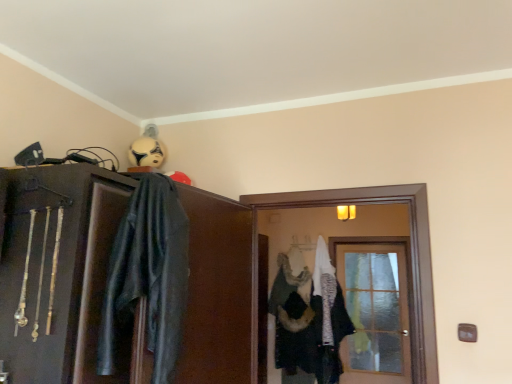
The image size is (512, 384). Describe the element at coordinates (59, 271) in the screenshot. I see `matte black cabinet at upper left` at that location.

Measure the distance between translucent glass door at center and camera.

The distance of translucent glass door at center from camera is 6.02 feet.

Measure the distance between point (293, 383) and camera.

The distance of point (293, 383) from camera is 4.34 meters.

Based on the photo, what is the approximate height of dark gray leather jacket at upper left?

It is 81.03 centimeters.

Locate an element on the screen. This screenshot has width=512, height=384. fur-like fabric hanger at center is located at coordinates (295, 259).

This screenshot has width=512, height=384. I want to click on white matte helmet at upper center, so [x=146, y=151].

The image size is (512, 384). I want to click on screen door in front of the white matte helmet at upper center, so click(x=411, y=259).

Is translucent glass door at center positioned in front of white matte helmet at upper center?

Yes, it is.

From the image's perspective, relative to white matte helmet at upper center, is translucent glass door at center above or below?

Based on their image positions, translucent glass door at center is located beneath white matte helmet at upper center.

Is the surface of translucent glass door at center in direct contact with white matte helmet at upper center?

They are not placed beside each other.

The image size is (512, 384). I want to click on hanger below the translucent glass door at center (from the image's perspective), so click(x=295, y=259).

Between translucent glass door at center and fur-like fabric hanger at center, which one has smaller width?

translucent glass door at center.

Which of these two, translucent glass door at center or fur-like fabric hanger at center, stands shorter?

fur-like fabric hanger at center is shorter.

Is translucent glass door at center with fur-like fabric hanger at center?

No.

In the image, there is a dark gray leather jacket at upper left. At what (x,y) coordinates should I click in order to perform the action: click on door below it (from the image's perspective). Please return your answer as a coordinate pair (x, y). The width and height of the screenshot is (512, 384). Looking at the image, I should click on (375, 311).

Is point (377, 298) behind point (147, 302)?

Yes.

Can you confirm if clear glass door at center is positioned to the left of dark gray leather jacket at upper left?

Incorrect, clear glass door at center is not on the left side of dark gray leather jacket at upper left.

From a real-world perspective, which object stands above the other?

From a 3D spatial view, matte black cabinet at upper left is above.

Is matte black cabinet at upper left in contact with white fuzzy coat at center?

matte black cabinet at upper left and white fuzzy coat at center are not in contact.

Considering the sizes of matte black cabinet at upper left and white fuzzy coat at center in the image, is matte black cabinet at upper left bigger or smaller than white fuzzy coat at center?

In the image, matte black cabinet at upper left appears to be larger than white fuzzy coat at center.

Could you tell me if matte black cabinet at upper left is facing white fuzzy coat at center?

No, matte black cabinet at upper left is not turned towards white fuzzy coat at center.

Considering the positions of points (350, 203) and (353, 272), is point (350, 203) closer to camera compared to point (353, 272)?

Yes, it is.

Is translucent glass door at center wider than clear glass door at center?

Indeed, translucent glass door at center has a greater width compared to clear glass door at center.

Where is `door lying behind the translucent glass door at center`? door lying behind the translucent glass door at center is located at coordinates (375, 311).

Which object is closer to the camera, translucent glass door at center or clear glass door at center?

translucent glass door at center.

Does white matte helmet at upper center have a larger size compared to dark gray leather jacket at upper left?

Actually, white matte helmet at upper center might be smaller than dark gray leather jacket at upper left.

In the scene shown: Does white matte helmet at upper center come in front of dark gray leather jacket at upper left?

No.

Is the surface of white matte helmet at upper center in direct contact with dark gray leather jacket at upper left?

white matte helmet at upper center and dark gray leather jacket at upper left are clearly separated.

Looking at this image, would you say white matte helmet at upper center contains dark gray leather jacket at upper left?

That's incorrect, dark gray leather jacket at upper left is not inside white matte helmet at upper center.

Is fur-like fabric hanger at center far away from white fuzzy coat at center?

fur-like fabric hanger at center is near white fuzzy coat at center, not far away.

Is white fuzzy coat at center at the back of fur-like fabric hanger at center?

No, white fuzzy coat at center is not at the back of fur-like fabric hanger at center.

Measure the distance from fur-like fabric hanger at center to white fuzzy coat at center.

fur-like fabric hanger at center and white fuzzy coat at center are 17.11 inches apart from each other.

Which is less distant, (297, 252) or (290, 381)?

Clearly, point (297, 252) is more distant from the camera than point (290, 381).

This screenshot has height=384, width=512. What are the coordinates of `comic book character above the translucent glass door at center (from a real-world perspective)` in the screenshot? It's located at (146, 151).

The image size is (512, 384). I want to click on hanger below the translucent glass door at center (from the image's perspective), so click(x=295, y=259).

Based on their spatial positions, is fur-like fabric hanger at center or white matte helmet at upper center closer to matte black cabinet at upper left?

white matte helmet at upper center is closer to matte black cabinet at upper left.

Considering their positions, is clear glass door at center positioned further to translucent glass door at center than white matte helmet at upper center?

Based on the image, clear glass door at center appears to be further to translucent glass door at center.

Considering their positions, is white fuzzy coat at center positioned closer to white matte helmet at upper center than translucent glass door at center?

translucent glass door at center.

Which object lies further to the anchor point white matte helmet at upper center, translucent glass door at center or dark gray leather jacket at upper left?

translucent glass door at center is further to white matte helmet at upper center.

Estimate the real-world distances between objects in this image. Which object is closer to matte black cabinet at upper left, translucent glass door at center or dark gray leather jacket at upper left?

dark gray leather jacket at upper left lies closer to matte black cabinet at upper left than the other object.

Based on their spatial positions, is white matte helmet at upper center or dark gray leather jacket at upper left further from fur-like fabric hanger at center?

dark gray leather jacket at upper left is positioned further to the anchor fur-like fabric hanger at center.

Which object lies nearer to the anchor point white matte helmet at upper center, translucent glass door at center or white fuzzy coat at center?

translucent glass door at center is positioned closer to the anchor white matte helmet at upper center.

From the image, which object appears to be nearer to matte black cabinet at upper left, white fuzzy coat at center or translucent glass door at center?

Based on the image, translucent glass door at center appears to be nearer to matte black cabinet at upper left.

The width and height of the screenshot is (512, 384). What are the coordinates of `screen door positioned between dark gray leather jacket at upper left and clear glass door at center from near to far` in the screenshot? It's located at (411, 259).

Locate an element on the screen. The width and height of the screenshot is (512, 384). comic book character between translucent glass door at center and fur-like fabric hanger at center in the front-back direction is located at coordinates (146, 151).

Where is `comic book character between matte black cabinet at upper left and white fuzzy coat at center from front to back`? This screenshot has height=384, width=512. comic book character between matte black cabinet at upper left and white fuzzy coat at center from front to back is located at coordinates (146, 151).

I want to click on cabinetry between dark gray leather jacket at upper left and white fuzzy coat at center in the front-back direction, so click(59, 271).